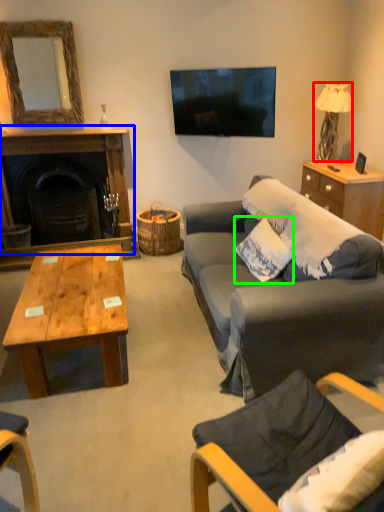
Question: Estimate the real-world distances between objects in this image. Which object is farther from lamp (highlighted by a red box), fireplace (highlighted by a blue box) or pillow (highlighted by a green box)?

Choices:
 (A) fireplace
 (B) pillow

Answer: (A)